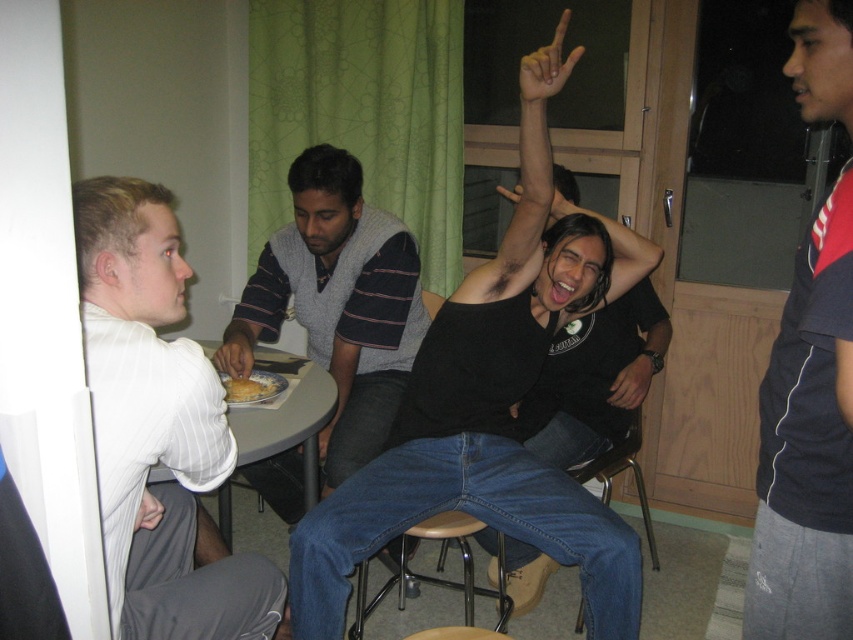
You are a guest at this gathering and want to grab the golden brown bread at center. However, there is a yellow painted finger at upper center blocking your view. Can you reach the bread without moving the finger?

The yellow painted finger at upper center is in front of the golden brown bread at center, so you can reach the bread without moving the finger because the finger is blocking the view but not necessarily obstructing the path.

You are an artist who needs to paint a yellow finger at the exact position mentioned in the scene description. The room has a wooden door with glass panels in the background. Can you confirm if the yellow painted finger at upper center is located near the door?

The yellow painted finger at upper center is located at point (546, 67), which is near the wooden door with glass panels in the background, so yes, it is near the door.

You are a delivery robot with a 45 cm wide package. You need to place it between the black matte shirt at center and the white plastic table at lower left. Is there enough space?

The distance between the black matte shirt at center and the white plastic table at lower left is 44.02 centimeters. Since the package is 45 cm wide, there isn not enough space to place it between them.